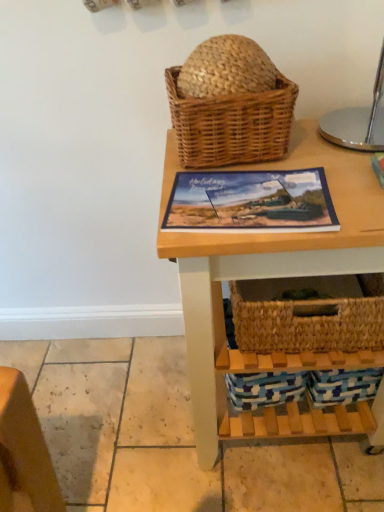
What is the approximate height of matte plastic picture frame at center?

0.61 inches.

This screenshot has height=512, width=384. Describe the element at coordinates (229, 104) in the screenshot. I see `woven brown picnic basket at upper center` at that location.

The image size is (384, 512). I want to click on natural wood table at center, so click(268, 272).

Between natural wood table at center and matte plastic picture frame at center, which one has smaller width?

matte plastic picture frame at center is thinner.

Which is in front, natural wood table at center or matte plastic picture frame at center?

Positioned in front is natural wood table at center.

From a real-world perspective, is natural wood table at center positioned over matte plastic picture frame at center based on gravity?

No, from a real-world perspective, natural wood table at center is not over matte plastic picture frame at center

Is natural wood table at center taller or shorter than matte plastic picture frame at center?

Considering their sizes, natural wood table at center has more height than matte plastic picture frame at center.

Is matte plastic picture frame at center positioned far away from natural wood table at center?

matte plastic picture frame at center is near natural wood table at center, not far away.

Is matte plastic picture frame at center positioned beyond the bounds of natural wood table at center?

No, matte plastic picture frame at center is inside natural wood table at center's boundary.

Could you tell me if matte plastic picture frame at center is turned towards natural wood table at center?

Yes, matte plastic picture frame at center faces towards natural wood table at center.

Does point (180, 100) appear closer or farther from the camera than point (172, 225)?

Point (180, 100) is farther from the camera than point (172, 225).

Considering the relative sizes of woven brown picnic basket at upper center and matte plastic picture frame at center in the image provided, is woven brown picnic basket at upper center shorter than matte plastic picture frame at center?

No, woven brown picnic basket at upper center is not shorter than matte plastic picture frame at center.

Is the surface of woven brown picnic basket at upper center in direct contact with matte plastic picture frame at center?

No, woven brown picnic basket at upper center is not next to matte plastic picture frame at center.

Could you tell me if woven brown picnic basket at upper center is turned towards matte plastic picture frame at center?

Yes, woven brown picnic basket at upper center is facing matte plastic picture frame at center.

Which of these two, woven brown picnic basket at upper center or natural wood table at center, is wider?

natural wood table at center is wider.

From the image's perspective, which object appears higher, woven brown picnic basket at upper center or natural wood table at center?

woven brown picnic basket at upper center, from the image's perspective.

At what (x,y) coordinates should I click in order to perform the action: click on picnic basket on the left of natural wood table at center. Please return your answer as a coordinate pair (x, y). This screenshot has height=512, width=384. Looking at the image, I should click on (229, 104).

Looking at this image, who is bigger, woven brown picnic basket at upper center or natural wood table at center?

Bigger between the two is natural wood table at center.

Is natural wood table at center facing towards woven brown picnic basket at upper center?

No, natural wood table at center is not turned towards woven brown picnic basket at upper center.

Is natural wood table at center further to camera compared to woven brown picnic basket at upper center?

No, it is in front of woven brown picnic basket at upper center.

Is natural wood table at center outside of woven brown picnic basket at upper center?

Yes.

The width and height of the screenshot is (384, 512). In order to click on table on the right of woven brown picnic basket at upper center in this screenshot , I will do (268, 272).

Based on the photo, is matte plastic picture frame at center oriented towards woven brown picnic basket at upper center?

No, matte plastic picture frame at center does not turn towards woven brown picnic basket at upper center.

Is matte plastic picture frame at center taller or shorter than woven brown picnic basket at upper center?

matte plastic picture frame at center is shorter than woven brown picnic basket at upper center.

Considering the relative sizes of matte plastic picture frame at center and woven brown picnic basket at upper center in the image provided, is matte plastic picture frame at center wider than woven brown picnic basket at upper center?

In fact, matte plastic picture frame at center might be narrower than woven brown picnic basket at upper center.

Which object is closer to the camera taking this photo, matte plastic picture frame at center or woven brown picnic basket at upper center?

matte plastic picture frame at center is in front.

What are the coordinates of `picture frame above the natural wood table at center (from the image's perspective)` in the screenshot? It's located at (251, 202).

This screenshot has height=512, width=384. What are the coordinates of `picture frame above the natural wood table at center (from a real-world perspective)` in the screenshot? It's located at (251, 202).

Considering their positions, is woven brown picnic basket at upper center positioned further to natural wood table at center than matte plastic picture frame at center?

woven brown picnic basket at upper center.

Looking at the image, which one is located further to natural wood table at center, matte plastic picture frame at center or woven brown picnic basket at upper center?

woven brown picnic basket at upper center is further to natural wood table at center.

Estimate the real-world distances between objects in this image. Which object is closer to matte plastic picture frame at center, natural wood table at center or woven brown picnic basket at upper center?

Among the two, woven brown picnic basket at upper center is located nearer to matte plastic picture frame at center.

Considering their positions, is matte plastic picture frame at center positioned further to woven brown picnic basket at upper center than natural wood table at center?

natural wood table at center.

Considering their positions, is natural wood table at center positioned closer to woven brown picnic basket at upper center than matte plastic picture frame at center?

Among the two, matte plastic picture frame at center is located nearer to woven brown picnic basket at upper center.

Consider the image. From the image, which object appears to be farther from matte plastic picture frame at center, woven brown picnic basket at upper center or natural wood table at center?

The object further to matte plastic picture frame at center is natural wood table at center.

The height and width of the screenshot is (512, 384). I want to click on picture frame between woven brown picnic basket at upper center and natural wood table at center in the vertical direction, so click(x=251, y=202).